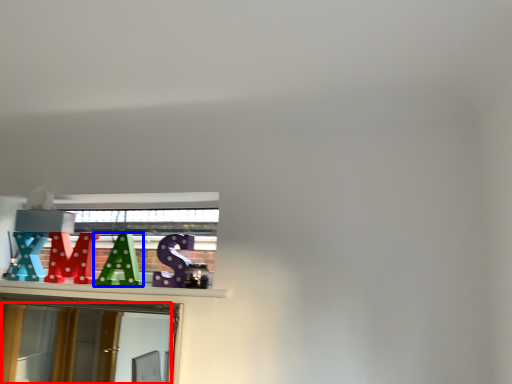
Question: Which of the following is the closest to the observer, mirror (highlighted by a red box) or alphabet (highlighted by a blue box)?

Choices:
 (A) mirror
 (B) alphabet

Answer: (A)